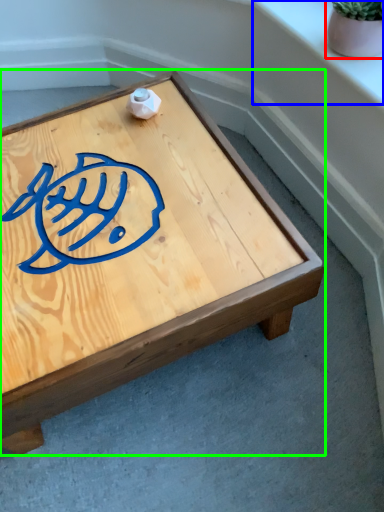
Question: Based on their relative distances, which object is farther from flowerpot (highlighted by a red box)? Choose from window sill (highlighted by a blue box) and coffee table (highlighted by a green box).

Choices:
 (A) window sill
 (B) coffee table

Answer: (B)